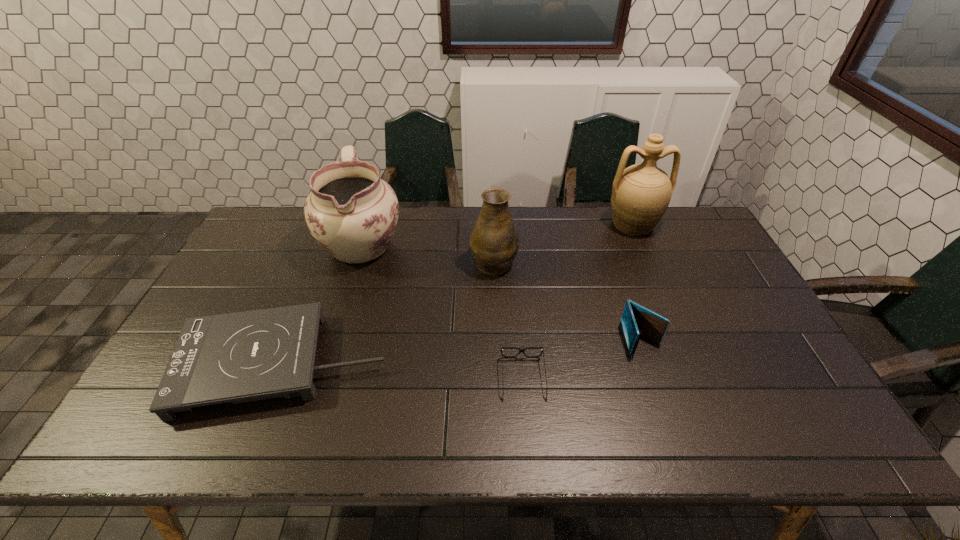
Find the location of `the rightmost pitcher`. the rightmost pitcher is located at coordinates (641, 193).

You are a GUI agent. You are given a task and a screenshot of the screen. Output one action in this format:
    pyautogui.click(x=<x>, y=<y>)
    Task: Click on the leftmost pitcher
    The height and width of the screenshot is (540, 960).
    Given the screenshot: What is the action you would take?
    pyautogui.click(x=352, y=213)

Locate an element on the screen. This screenshot has width=960, height=540. the second pitcher from left to right is located at coordinates tap(494, 241).

Where is `the third shortest object`? the third shortest object is located at coordinates (636, 321).

Locate an element on the screen. This screenshot has height=540, width=960. the fifth tallest object is located at coordinates (247, 356).

Locate an element on the screen. spectacles is located at coordinates (520, 350).

I want to click on vacant space located on the right of the rightmost pitcher, so click(698, 224).

Where is `vacant space located on the spout of the leftmost pitcher`? vacant space located on the spout of the leftmost pitcher is located at coordinates (330, 343).

Identify the location of vacant region located 0.100m on the handle side of the second pitcher from left to right. The image size is (960, 540). (492, 226).

The height and width of the screenshot is (540, 960). I want to click on vacant region located on the handle side of the second pitcher from left to right, so click(492, 221).